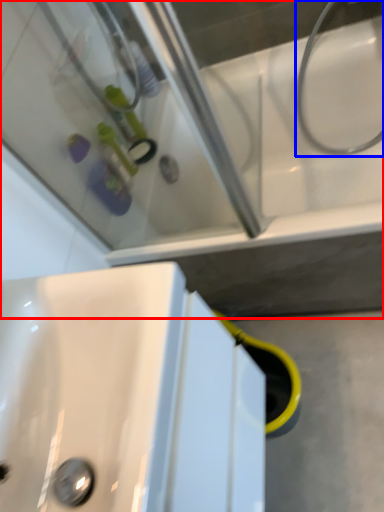
Question: Which object is further to the camera taking this photo, bath (highlighted by a red box) or plumbing fixture (highlighted by a blue box)?

Choices:
 (A) bath
 (B) plumbing fixture

Answer: (B)